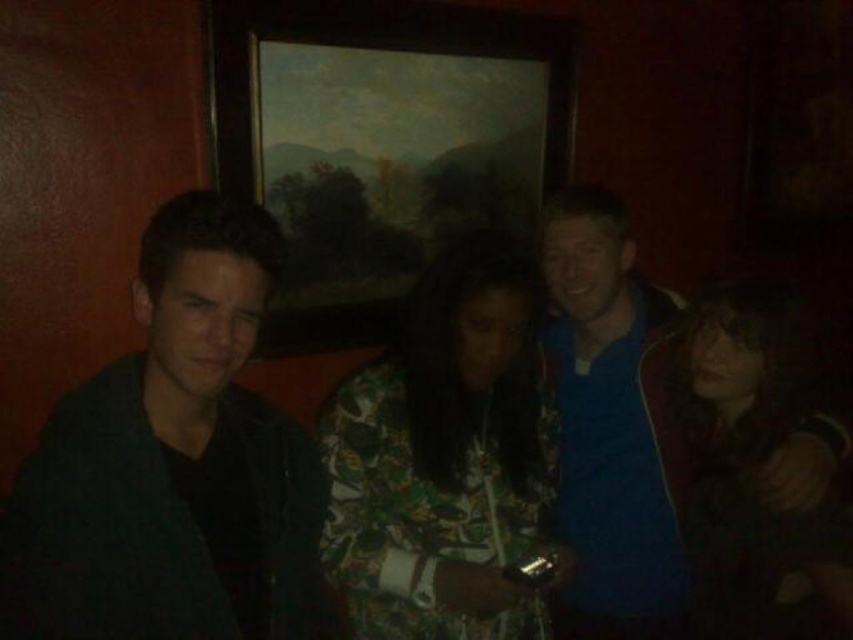
Question: Does floral-patterned dress at center have a lesser width compared to fluffy brown hair at center?

Choices:
 (A) yes
 (B) no

Answer: (B)

Question: Is floral-patterned dress at center wider than blue fabric jacket at right?

Choices:
 (A) no
 (B) yes

Answer: (B)

Question: Which is nearer to the blue fabric jacket at right?

Choices:
 (A) floral-patterned dress at center
 (B) fluffy brown hair at center
 (C) dark green leather jacket at left

Answer: (B)

Question: Based on their relative distances, which object is nearer to the floral-patterned dress at center?

Choices:
 (A) blue fabric jacket at right
 (B) wooden framed painting at upper center
 (C) fluffy brown hair at center
 (D) dark green leather jacket at left

Answer: (D)

Question: Is dark green leather jacket at left wider than wooden framed painting at upper center?

Choices:
 (A) yes
 (B) no

Answer: (B)

Question: Considering the real-world distances, which object is farthest from the dark green leather jacket at left?

Choices:
 (A) fluffy brown hair at center
 (B) blue fabric jacket at right
 (C) wooden framed painting at upper center

Answer: (C)